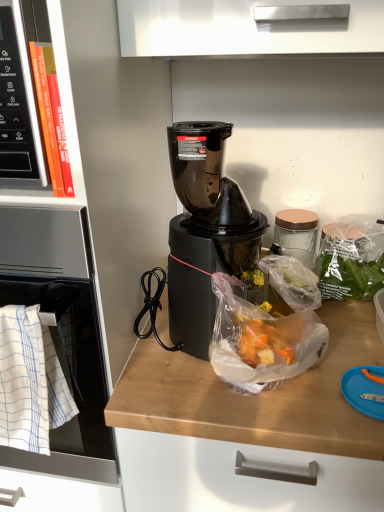
The width and height of the screenshot is (384, 512). I want to click on orange hardcover book at left, so 52,118.

Locate an element on the screen. black plastic blender at center is located at coordinates (205, 230).

Consider the image. What is the approximate height of satin silver oven at left?

satin silver oven at left is 23.63 inches in height.

What do you see at coordinates (30, 382) in the screenshot? The image size is (384, 512). I see `white woven towel at left` at bounding box center [30, 382].

Measure the distance between point [32,317] and camera.

Point [32,317] is 65.60 centimeters away from camera.

You are a GUI agent. You are given a task and a screenshot of the screen. Output one action in this format:
    pyautogui.click(x=<x>, y=<y>)
    Task: Click on the orange hardcover book at left
    
    Given the screenshot: What is the action you would take?
    pyautogui.click(x=52, y=118)

Based on their positions, is black plastic blender at center located to the left or right of translucent plastic bag at center?

In the image, black plastic blender at center appears on the left side of translucent plastic bag at center.

At what (x,y) coordinates should I click in order to perform the action: click on blender that is above the translucent plastic bag at center (from a real-world perspective). Please return your answer as a coordinate pair (x, y). The width and height of the screenshot is (384, 512). Looking at the image, I should click on click(x=205, y=230).

Is point (212, 126) more distant than point (264, 349)?

Yes, it is.

From the image's perspective, which is below, black plastic blender at center or translucent plastic bag at center?

translucent plastic bag at center, from the image's perspective.

Considering the relative sizes of white woven towel at left and orange hardcover book at left in the image provided, is white woven towel at left smaller than orange hardcover book at left?

Actually, white woven towel at left might be larger than orange hardcover book at left.

Is point (49, 420) farther from camera compared to point (48, 157)?

Yes, it is behind point (48, 157).

Relative to orange hardcover book at left, is white woven towel at left in front or behind?

white woven towel at left is behind orange hardcover book at left.

From the image's perspective, is white woven towel at left over orange hardcover book at left?

Incorrect, from the image's perspective, white woven towel at left is lower than orange hardcover book at left.

Looking at this image, can we say white woven towel at left lies outside black plastic blender at center?

That's correct, white woven towel at left is outside of black plastic blender at center.

Considering the sizes of objects white woven towel at left and black plastic blender at center in the image provided, who is wider, white woven towel at left or black plastic blender at center?

black plastic blender at center is wider.

Is white woven towel at left smaller than black plastic blender at center?

Correct, white woven towel at left occupies less space than black plastic blender at center.

Find the location of a particular element. This screenshot has width=384, height=512. cloth that is in front of the black plastic blender at center is located at coordinates (30, 382).

Choose the correct answer: Is orange hardcover book at left inside satin silver oven at left or outside it?

orange hardcover book at left cannot be found inside satin silver oven at left.

Find the location of a particular element. Image resolution: width=384 pixels, height=512 pixels. book that is on the right side of satin silver oven at left is located at coordinates (52, 118).

Considering the points (39, 108) and (66, 468), which point is in front, point (39, 108) or point (66, 468)?

The point (39, 108) is more forward.

Consider the image. Is orange hardcover book at left positioned far away from satin silver oven at left?

No, orange hardcover book at left is not far from satin silver oven at left.

From a real-world perspective, is orange hardcover book at left located beneath translucent plastic bag at center?

No.

Does orange hardcover book at left contain translucent plastic bag at center?

No, translucent plastic bag at center is not surrounded by orange hardcover book at left.

Which is in front, point (65, 174) or point (278, 288)?

The point (65, 174) is in front.

In the scene shown: Does white woven towel at left have a greater height compared to satin silver oven at left?

No, white woven towel at left is not taller than satin silver oven at left.

Considering the relative positions of white woven towel at left and satin silver oven at left in the image provided, is white woven towel at left to the left or to the right of satin silver oven at left?

white woven towel at left is positioned on satin silver oven at left's right side.

Considering the sizes of objects white woven towel at left and satin silver oven at left in the image provided, who is bigger, white woven towel at left or satin silver oven at left?

satin silver oven at left.

Locate an element on the screen. oven above the white woven towel at left (from a real-world perspective) is located at coordinates (61, 332).

Can you see orange hardcover book at left touching white woven towel at left?

orange hardcover book at left is not next to white woven towel at left, and they're not touching.

Considering the sizes of objects orange hardcover book at left and white woven towel at left in the image provided, who is thinner, orange hardcover book at left or white woven towel at left?

Thinner between the two is orange hardcover book at left.

Does orange hardcover book at left turn towards white woven towel at left?

No.

Does point (52, 123) come closer to viewer compared to point (49, 349)?

Yes, it is in front of point (49, 349).

Locate an element on the screen. plastic bag behind the black plastic blender at center is located at coordinates (267, 329).

Identify the location of cloth lying below the orange hardcover book at left (from the image's perspective). (30, 382).

Looking at the image, which one is located closer to translucent plastic bag at center, orange hardcover book at left or white woven towel at left?

Among the two, white woven towel at left is located nearer to translucent plastic bag at center.

Considering their positions, is white woven towel at left positioned closer to satin silver oven at left than black plastic blender at center?

Among the two, white woven towel at left is located nearer to satin silver oven at left.

When comparing their distances from orange hardcover book at left, does white woven towel at left or black plastic blender at center seem further?

Based on the image, white woven towel at left appears to be further to orange hardcover book at left.

Considering their positions, is translucent plastic bag at center positioned closer to orange hardcover book at left than satin silver oven at left?

The object closer to orange hardcover book at left is satin silver oven at left.

Based on their spatial positions, is orange hardcover book at left or white woven towel at left closer to black plastic blender at center?

orange hardcover book at left lies closer to black plastic blender at center than the other object.

In the scene shown: Which object lies nearer to the anchor point orange hardcover book at left, white woven towel at left or translucent plastic bag at center?

white woven towel at left lies closer to orange hardcover book at left than the other object.

Which object lies further to the anchor point translucent plastic bag at center, satin silver oven at left or black plastic blender at center?

satin silver oven at left is positioned further to the anchor translucent plastic bag at center.

Considering their positions, is black plastic blender at center positioned closer to satin silver oven at left than white woven towel at left?

white woven towel at left is positioned closer to the anchor satin silver oven at left.

The height and width of the screenshot is (512, 384). I want to click on book situated between white woven towel at left and translucent plastic bag at center from left to right, so click(52, 118).

Where is `blender located between white woven towel at left and translucent plastic bag at center in the left-right direction`? This screenshot has width=384, height=512. blender located between white woven towel at left and translucent plastic bag at center in the left-right direction is located at coordinates (205, 230).

Identify the location of blender between satin silver oven at left and translucent plastic bag at center. (205, 230).

Locate an element on the screen. This screenshot has width=384, height=512. book between satin silver oven at left and translucent plastic bag at center in the horizontal direction is located at coordinates (52, 118).